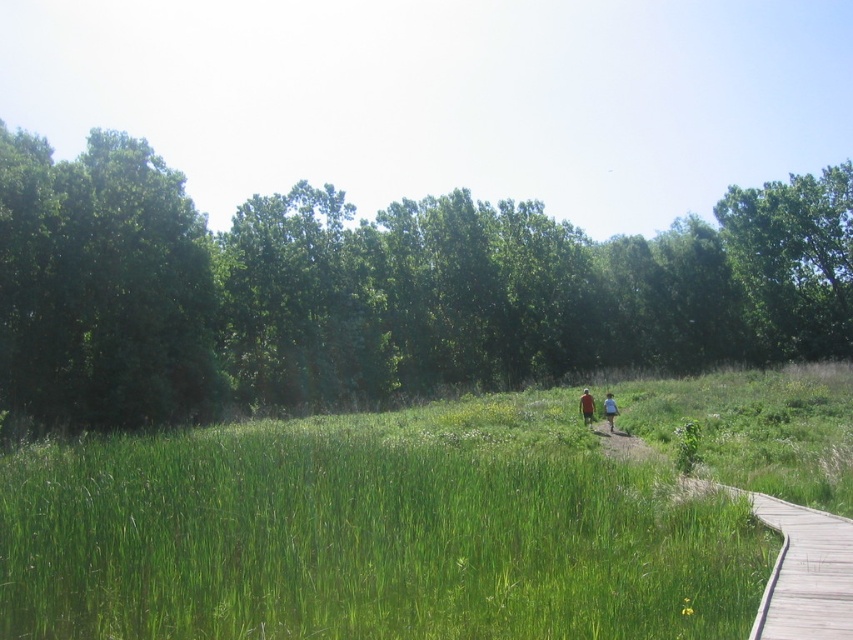
Question: Estimate the real-world distances between objects in this image. Which object is farther from the green leafy tree at left?

Choices:
 (A) red cotton shirt at center
 (B) green grassy couple at center

Answer: (A)

Question: Does green leafy tree at upper right have a greater width compared to red cotton shirt at center?

Choices:
 (A) no
 (B) yes

Answer: (B)

Question: Which object appears farthest from the camera in this image?

Choices:
 (A) green leafy tree at upper right
 (B) red cotton shirt at center
 (C) blue denim shorts at center
 (D) wooden boardwalk at lower right

Answer: (A)

Question: Which point appears closest to the camera in this image?

Choices:
 (A) (115, 328)
 (B) (593, 406)
 (C) (589, 401)

Answer: (C)

Question: Can you confirm if red cotton shirt at center is wider than blue denim shorts at center?

Choices:
 (A) yes
 (B) no

Answer: (A)

Question: Is green leafy tree at center bigger than red cotton shirt at center?

Choices:
 (A) no
 (B) yes

Answer: (B)